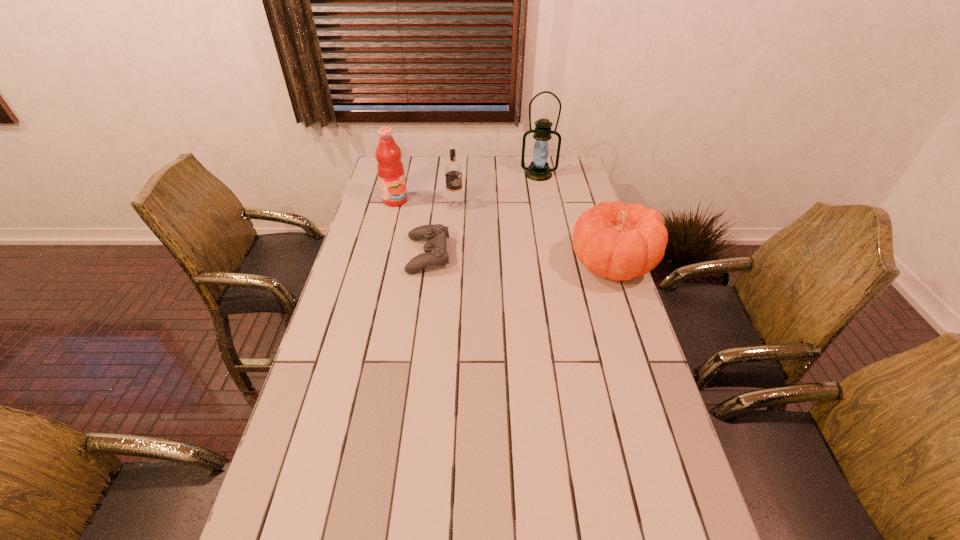
Locate an element on the screen. pumpkin that is at the right edge is located at coordinates (617, 241).

Locate an element on the screen. This screenshot has width=960, height=540. lantern situated at the right edge is located at coordinates (538, 170).

At what (x,y) coordinates should I click in order to perform the action: click on object located at the far right corner. Please return your answer as a coordinate pair (x, y). Looking at the image, I should click on (538, 170).

In the image, there is a desktop. Identify the location of vacant space at the far edge. (440, 180).

In the image, there is a desktop. Identify the location of vacant space at the left edge. The height and width of the screenshot is (540, 960). (368, 368).

This screenshot has width=960, height=540. I want to click on vacant space at the right edge of the desktop, so click(559, 220).

You are a GUI agent. You are given a task and a screenshot of the screen. Output one action in this format:
    pyautogui.click(x=<x>, y=<y>)
    Task: Click on the vacant space at the far left corner
    The height and width of the screenshot is (540, 960).
    Given the screenshot: What is the action you would take?
    pyautogui.click(x=375, y=177)

Locate an element on the screen. vacant area that lies between the vodka and the tallest object is located at coordinates (496, 190).

Where is `free spot between the farthest object and the pumpkin`? This screenshot has height=540, width=960. free spot between the farthest object and the pumpkin is located at coordinates (575, 219).

The image size is (960, 540). I want to click on free space between the leftmost object and the lantern, so point(467,187).